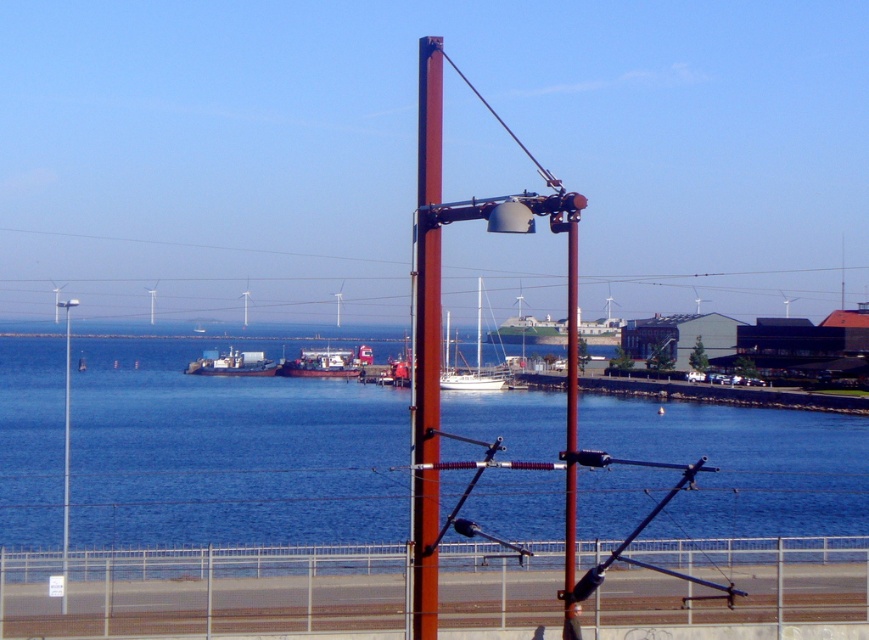
Is metallic gray ship at center taller than white plastic boat at center?

No.

Is point (261, 372) farther from camera compared to point (342, 362)?

That is False.

I want to click on metallic gray ship at center, so click(x=231, y=364).

Who is positioned more to the left, blue water at center or white plastic boat at center?

From the viewer's perspective, white plastic boat at center appears more on the left side.

Who is higher up, blue water at center or white plastic boat at center?

white plastic boat at center

Where is `blue water at center`? This screenshot has width=869, height=640. blue water at center is located at coordinates (229, 452).

Identify the location of blue water at center. This screenshot has height=640, width=869. (229, 452).

Can you confirm if metallic gray ship at center is positioned above white glossy sailboat at center?

No.

Does metallic gray ship at center appear under white glossy sailboat at center?

Yes, metallic gray ship at center is below white glossy sailboat at center.

What do you see at coordinates (231, 364) in the screenshot? This screenshot has height=640, width=869. I see `metallic gray ship at center` at bounding box center [231, 364].

This screenshot has height=640, width=869. I want to click on metallic gray ship at center, so click(231, 364).